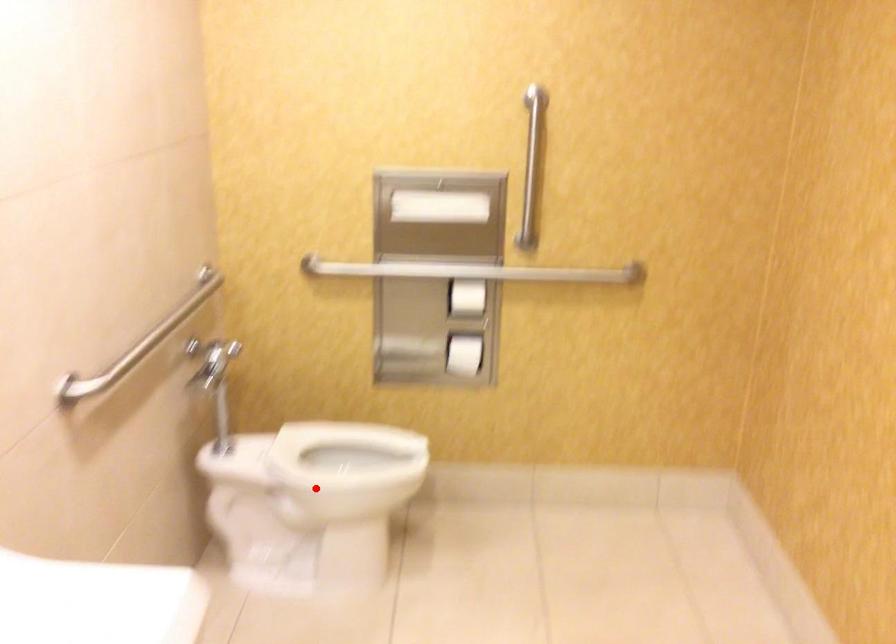
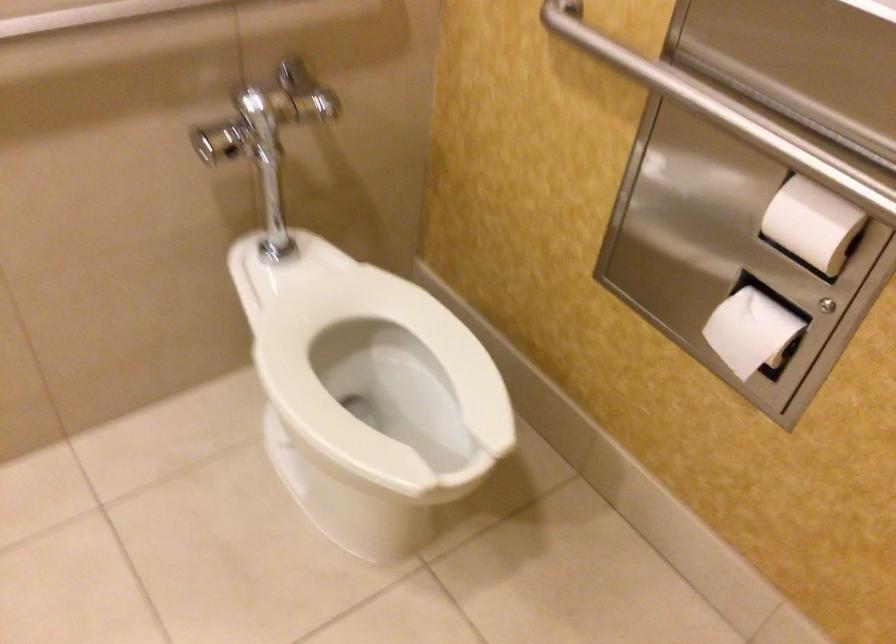
Question: I am providing you with two images of the same scene from different viewpoints. In image1, a red point is highlighted. Considering the same 3D point in image2, which of the following is correct?

Choices:
 (A) It is closer
 (B) It is farther

Answer: (A)